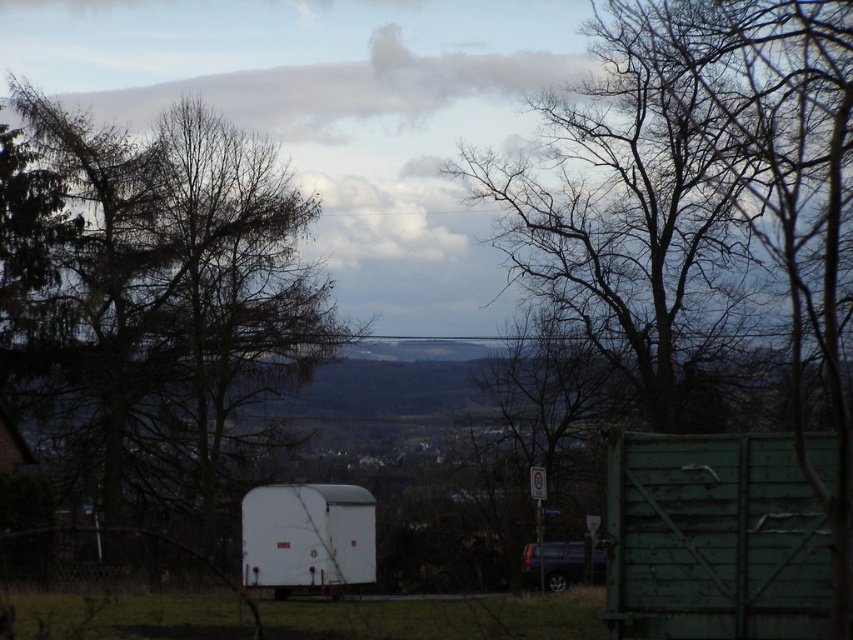
You are standing at the edge of the scene and want to walk towards the white matte trailer at center. Which direction should you walk to avoid the dark brown bark tree at left?

Since the dark brown bark tree at left is to the left of the white matte trailer at center, you should walk to the right to avoid the dark brown bark tree at left and reach the white matte trailer at center.